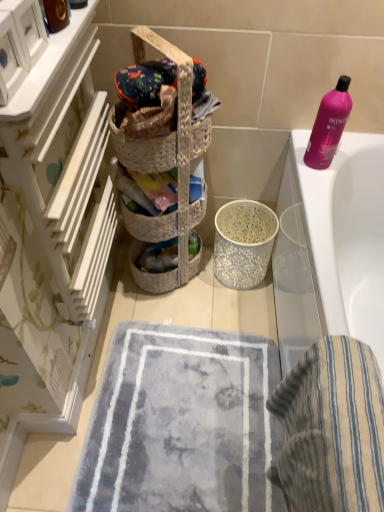
Where is `free space in front of pink plastic bottle at upper right`? The image size is (384, 512). free space in front of pink plastic bottle at upper right is located at coordinates (318, 187).